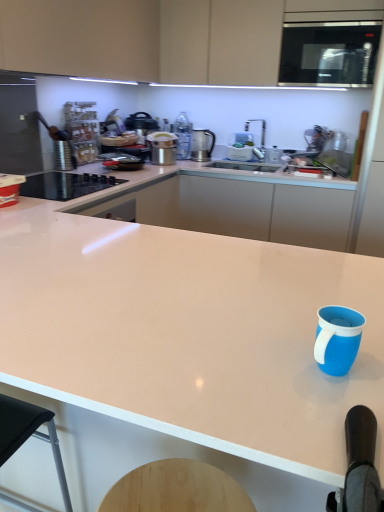
This screenshot has width=384, height=512. I want to click on vacant space that is to the left of blue matte mug at lower right, so click(x=234, y=361).